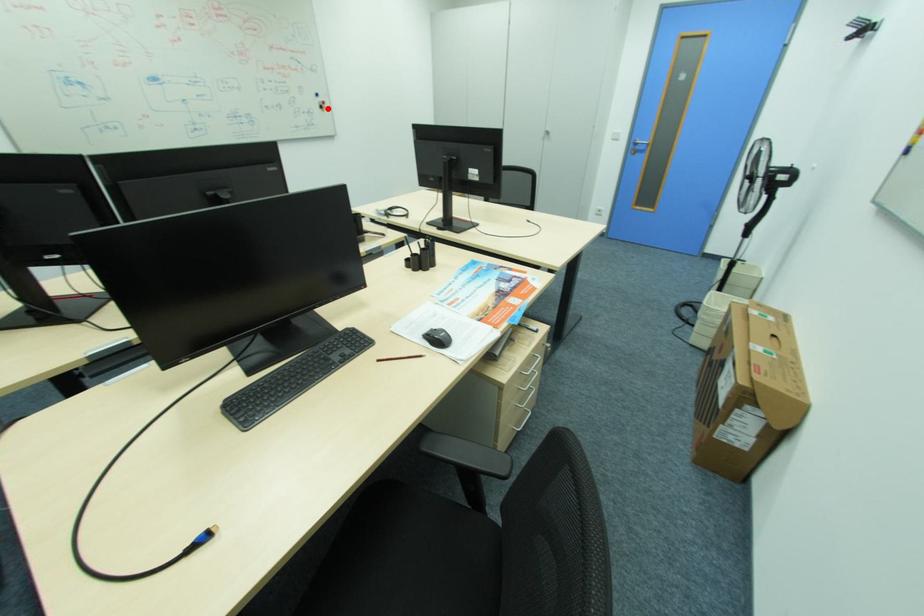
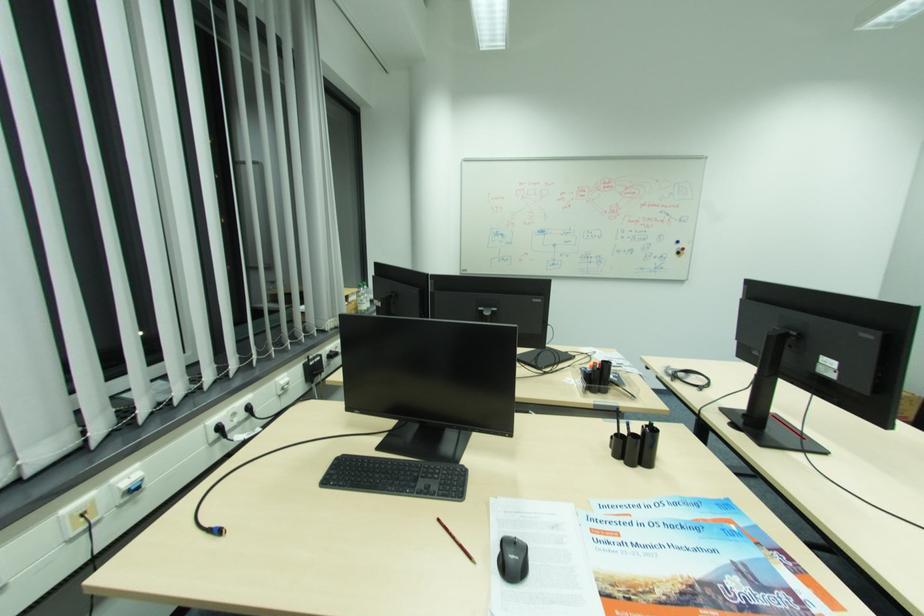
Question: I am providing you with two images of the same scene from different viewpoints. A red point is shown in image1. For the corresponding object point in image2, is it positioned nearer or farther from the camera?

Choices:
 (A) Nearer
 (B) Farther

Answer: (B)